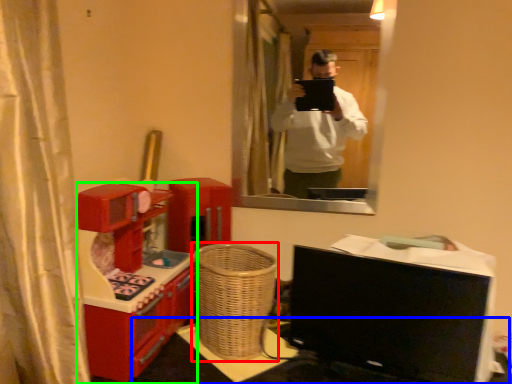
Question: Based on their relative distances, which object is nearer to basket (highlighted by a red box)? Choose from table (highlighted by a blue box) and furniture (highlighted by a green box).

Choices:
 (A) table
 (B) furniture

Answer: (A)